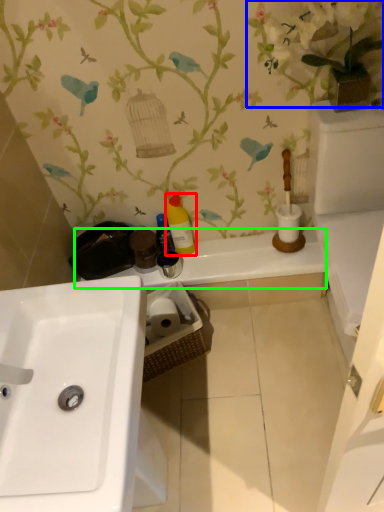
Question: Which object is the closest to the cleaning product (highlighted by a red box)? Choose among these: floral arrangement (highlighted by a blue box) or counter top (highlighted by a green box).

Choices:
 (A) floral arrangement
 (B) counter top

Answer: (B)